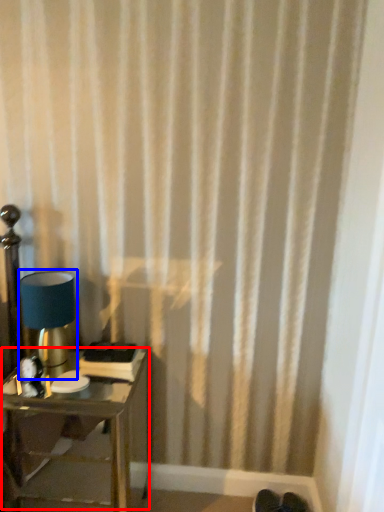
Question: Which object appears closest to the camera in this image, table (highlighted by a red box) or lamp (highlighted by a blue box)?

Choices:
 (A) table
 (B) lamp

Answer: (A)